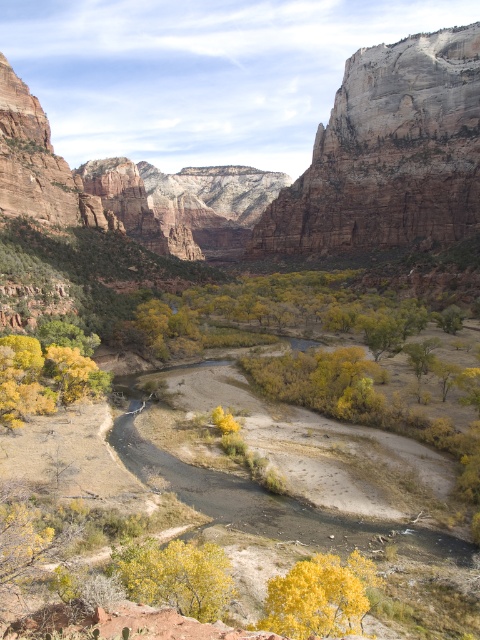
You are a hiker standing at the edge of the canyon and want to take a photo of both the yellow matte tree at center and the yellow leafy tree at lower center. Which tree will appear bigger in your photo?

The yellow matte tree at center will appear bigger in the photo because it is larger in size than the yellow leafy tree at lower center.